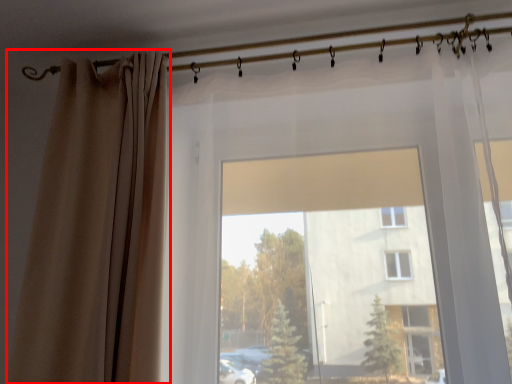
Question: From the image's perspective, where is curtain (annotated by the red box) located relative to clothesline?

Choices:
 (A) above
 (B) below

Answer: (B)